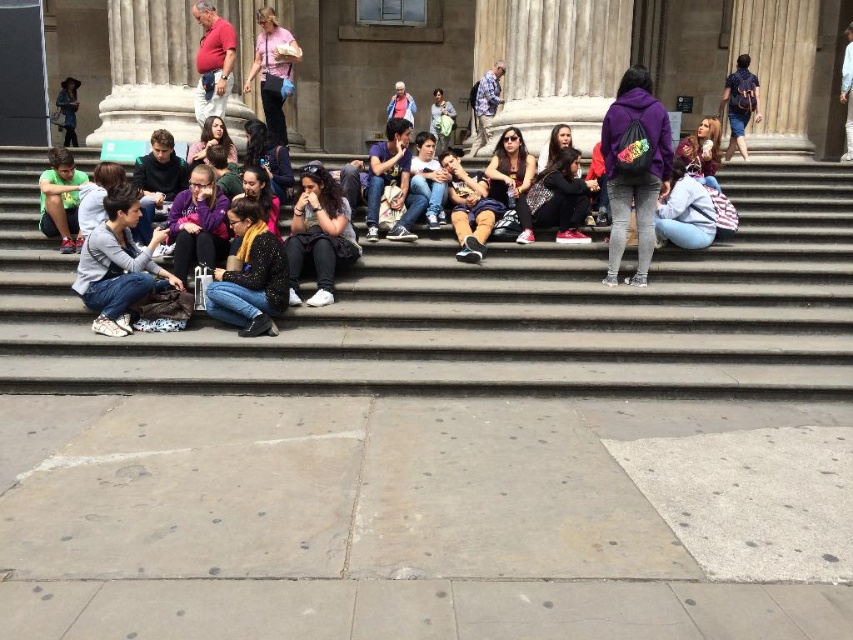
In the scene shown: You are a photographer trying to capture a candid shot of the group. You notice the matte gray sweater at lower left and the light blue denim jacket at upper center. Which clothing item should you focus on if you want to include both in the frame without cropping either?

The matte gray sweater at lower left is much taller than the light blue denim jacket at upper center, so focusing on the taller matte gray sweater at lower left would ensure both are visible in the frame.

You are organizing a photo shoot and need to ensure that the purple fleece jacket at center and the matte blue backpack at center are both visible in the frame. Given their sizes, which object might require more space to be fully captured in the photo?

The purple fleece jacket at center has a larger size compared to the matte blue backpack at center, so it would require more space to be fully captured in the photo.